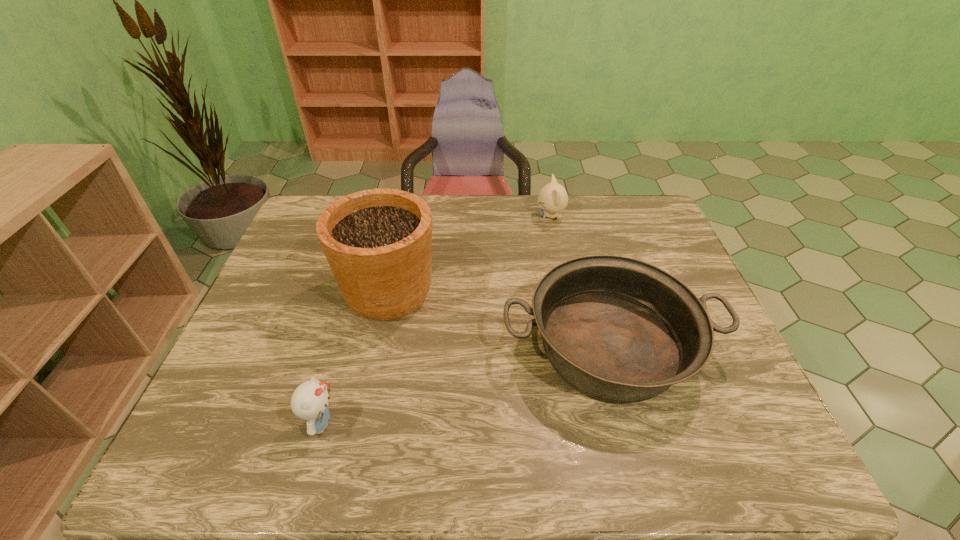
You are a GUI agent. You are given a task and a screenshot of the screen. Output one action in this format:
    pyautogui.click(x=<x>, y=<y>)
    Task: Click on the flowerpot
    
    Given the screenshot: What is the action you would take?
    pyautogui.click(x=378, y=242)

The height and width of the screenshot is (540, 960). Identify the location of the farthest object. (553, 198).

Identify the location of the farther kitten. (553, 198).

At what (x,y) coordinates should I click in order to perform the action: click on pan. Please return your answer as a coordinate pair (x, y). Looking at the image, I should click on (619, 329).

Where is `the nearer kitten`? The image size is (960, 540). the nearer kitten is located at coordinates (309, 402).

The height and width of the screenshot is (540, 960). I want to click on free space located on the right of the tallest object, so click(x=581, y=292).

This screenshot has height=540, width=960. Find the location of `free location located 0.320m on the face of the right kitten`. free location located 0.320m on the face of the right kitten is located at coordinates (442, 216).

The height and width of the screenshot is (540, 960). I want to click on vacant region located 0.360m on the face of the right kitten, so click(430, 216).

The width and height of the screenshot is (960, 540). In order to click on free location located 0.160m on the face of the right kitten in this screenshot , I will do `click(489, 216)`.

You are a GUI agent. You are given a task and a screenshot of the screen. Output one action in this format:
    pyautogui.click(x=<x>, y=<y>)
    Task: Click on the vacant space located 0.300m on the back of the pan
    Image resolution: width=960 pixels, height=540 pixels.
    Given the screenshot: What is the action you would take?
    pyautogui.click(x=577, y=226)